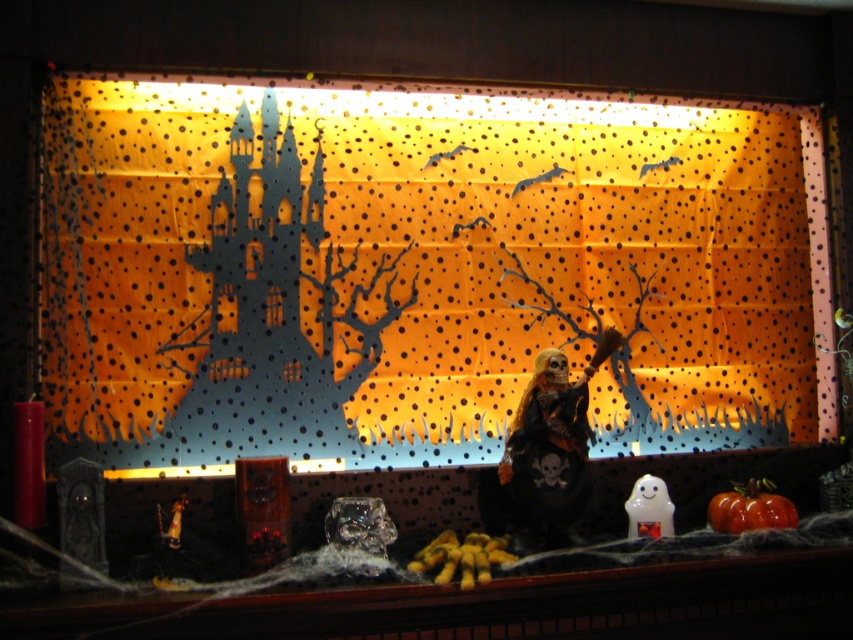
You are a trick or treater standing in front of the Halloween display. You want to find the orange matte pumpkin at lower right. Which direction should you look relative to the matte black skeleton at center?

The orange matte pumpkin at lower right is located to the right of the matte black skeleton at center, so you should look to the right of the matte black skeleton at center to find it.

You are setting up a Halloween display and need to place a decorative pumpkin exactly at the center of the scene. The matte black skeleton at center is currently occupying a specific location. Where should you place the pumpkin to ensure it is centered while avoiding the skeleton?

The matte black skeleton at center is located at point (418, 269), so you should place the pumpkin slightly away from those coordinates to center it while avoiding the skeleton.